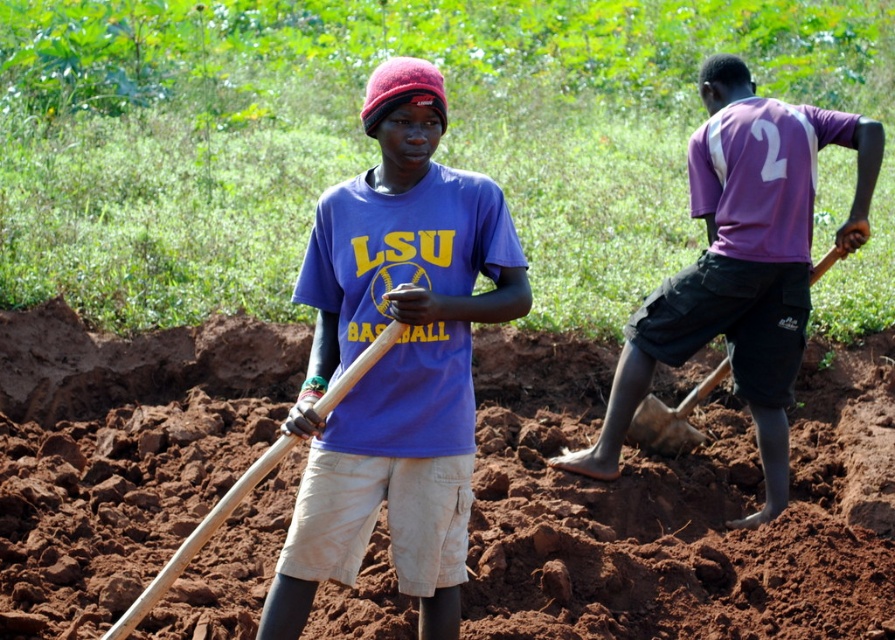
Question: Considering the real-world distances, which object is farthest from the blue matte shirt at center?

Choices:
 (A) brown soil at center
 (B) wooden shovel at right
 (C) wooden shovel at center
 (D) purple matte shirt at right

Answer: (B)

Question: Does wooden shovel at center appear on the right side of wooden shovel at right?

Choices:
 (A) no
 (B) yes

Answer: (A)

Question: Is blue matte shirt at center bigger than purple matte shirt at right?

Choices:
 (A) yes
 (B) no

Answer: (B)

Question: Can you confirm if brown soil at center is smaller than blue matte shirt at center?

Choices:
 (A) no
 (B) yes

Answer: (A)

Question: Which object is the farthest from the blue matte shirt at center?

Choices:
 (A) brown soil at center
 (B) purple matte shirt at right
 (C) wooden shovel at center

Answer: (B)

Question: Which object appears farthest from the camera in this image?

Choices:
 (A) brown soil at center
 (B) purple matte shirt at right
 (C) blue matte shirt at center
 (D) wooden shovel at center

Answer: (B)